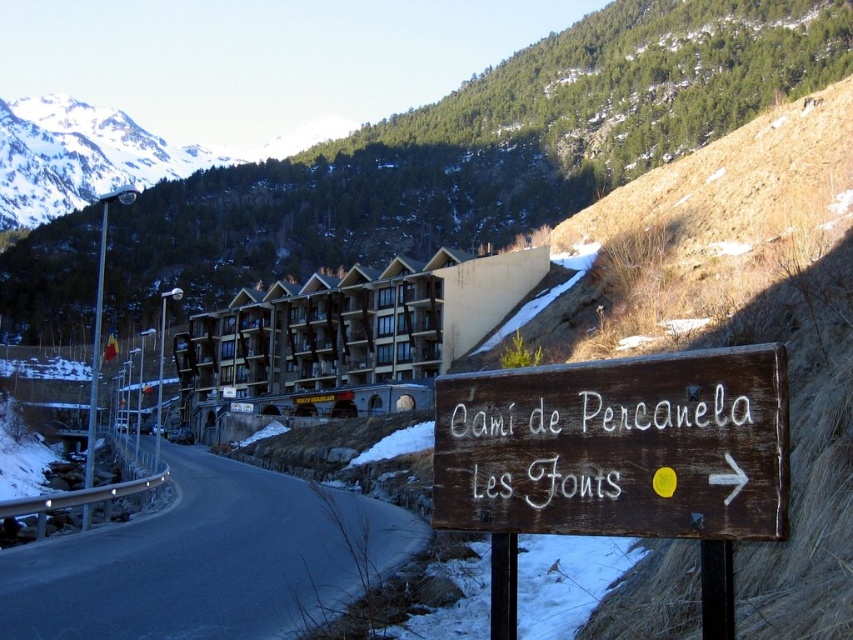
Which is in front, point (473, 486) or point (357, 348)?

Point (473, 486) is in front.

Between brown wooden sign at lower right and wooden cabin at center, which one is positioned lower?

wooden cabin at center is lower down.

Where is `brown wooden sign at lower right`? brown wooden sign at lower right is located at coordinates (618, 448).

I want to click on brown wooden sign at lower right, so pyautogui.click(x=618, y=448).

Who is lower down, brown wooden sign at lower right or black asphalt road at lower left?

Positioned lower is black asphalt road at lower left.

Between brown wooden sign at lower right and black asphalt road at lower left, which one is positioned higher?

brown wooden sign at lower right is higher up.

In order to click on brown wooden sign at lower right in this screenshot , I will do `click(618, 448)`.

Where is `brown wooden sign at lower right`? The image size is (853, 640). brown wooden sign at lower right is located at coordinates (618, 448).

Which is in front, point (186, 634) or point (184, 422)?

Point (186, 634) is more forward.

Who is more forward, [112,630] or [276,406]?

Point [112,630]

Where is `black asphalt road at lower left`? black asphalt road at lower left is located at coordinates (206, 561).